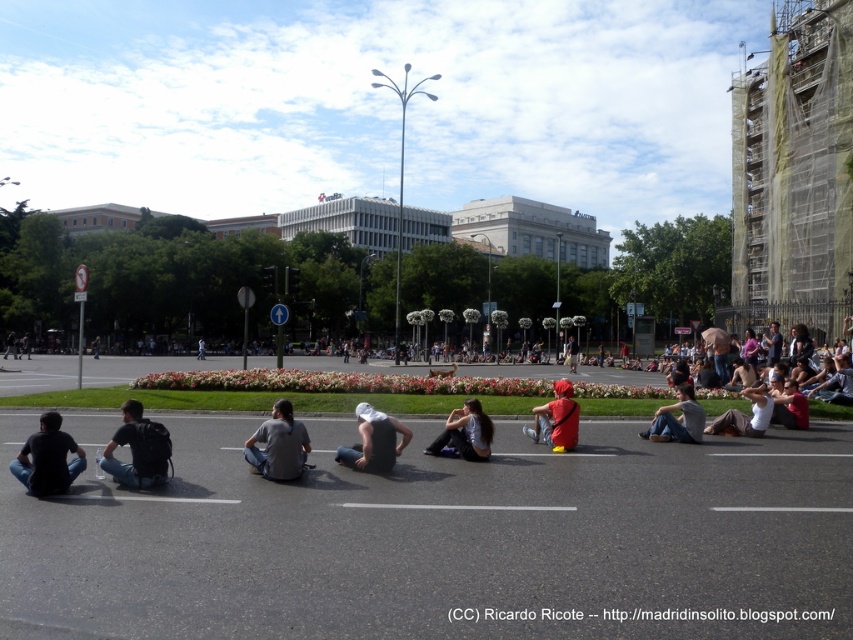
Which is below, dark gray fabric jacket at center or gray cotton shirt at lower right?

gray cotton shirt at lower right

Where is `dark gray fabric jacket at center`? dark gray fabric jacket at center is located at coordinates (465, 433).

At what (x,y) coordinates should I click in order to perform the action: click on dark gray fabric jacket at center. Please return your answer as a coordinate pair (x, y). This screenshot has height=640, width=853. Looking at the image, I should click on (465, 433).

Is point (300, 422) in front of point (555, 412)?

Yes, point (300, 422) is in front of point (555, 412).

Who is positioned more to the left, gray cotton shirt at center or red fabric cap at center?

gray cotton shirt at center

I want to click on gray cotton shirt at center, so click(x=277, y=444).

Is point (740, 428) positioned before point (567, 358)?

Yes, point (740, 428) is closer to viewer.

Is white cotton shirt at lower right taller than red fabric bag at center?

No.

Does point (757, 408) come in front of point (572, 342)?

Yes, it is in front of point (572, 342).

Image resolution: width=853 pixels, height=640 pixels. Find the location of `white cotton shirt at lower right`. white cotton shirt at lower right is located at coordinates (746, 413).